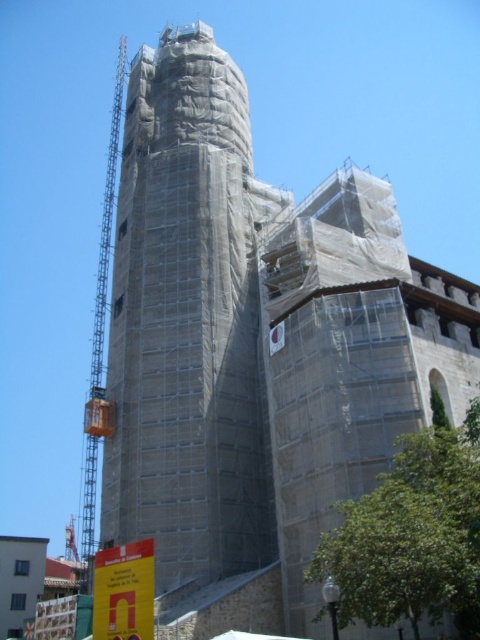
Question: Is gray concrete tower at center above orange metallic crane at left?

Choices:
 (A) yes
 (B) no

Answer: (A)

Question: Which of the following is the closest to the observer?

Choices:
 (A) orange metallic crane at left
 (B) gray concrete tower at center

Answer: (B)

Question: Observing the image, what is the correct spatial positioning of gray concrete tower at center in reference to orange metallic crane at left?

Choices:
 (A) right
 (B) left

Answer: (A)

Question: Does gray concrete tower at center have a greater width compared to orange metallic crane at left?

Choices:
 (A) yes
 (B) no

Answer: (B)

Question: Among these points, which one is farthest from the camera?

Choices:
 (A) (202, 532)
 (B) (119, 92)

Answer: (B)